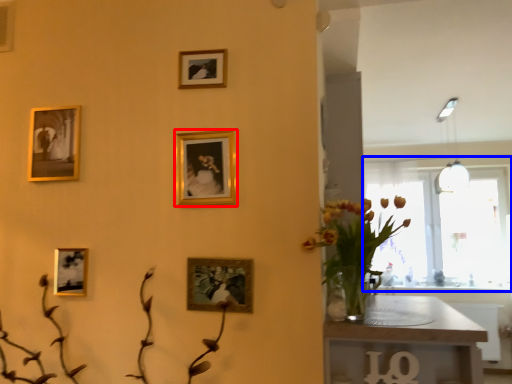
Question: Which object appears closest to the camera in this image, picture frame (highlighted by a red box) or window (highlighted by a blue box)?

Choices:
 (A) picture frame
 (B) window

Answer: (A)